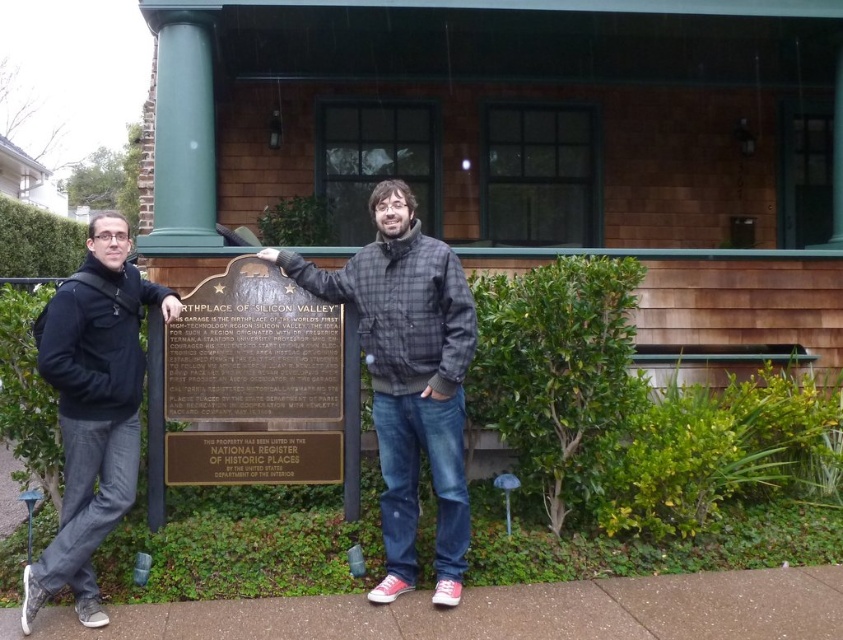
Question: Does matte black jacket at center appear on the right side of gold-bronze plaque at center?

Choices:
 (A) no
 (B) yes

Answer: (B)

Question: Which point is farther from the camera taking this photo?

Choices:
 (A) (822, 364)
 (B) (170, 412)

Answer: (A)

Question: Estimate the real-world distances between objects in this image. Which object is closer to the matte black jacket at center?

Choices:
 (A) black matte jacket at left
 (B) gold-bronze plaque at center
 (C) plaid jacket at center

Answer: (C)

Question: From the image, what is the correct spatial relationship of black matte jacket at left in relation to brown shingles at center?

Choices:
 (A) below
 (B) above

Answer: (A)

Question: Which point is closer to the camera?

Choices:
 (A) gold-bronze plaque at center
 (B) matte black jacket at center
 (C) plaid jacket at center
 (D) black matte jacket at left

Answer: (D)

Question: Is matte black jacket at center to the left of brown shingles at center from the viewer's perspective?

Choices:
 (A) yes
 (B) no

Answer: (A)